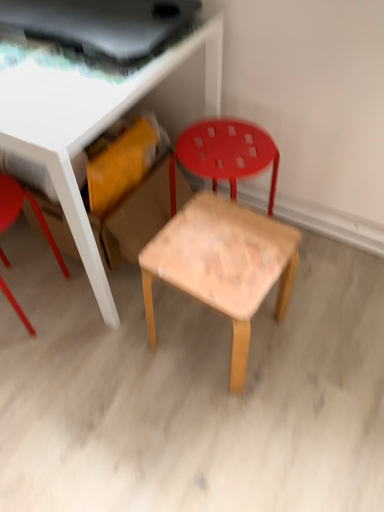
The width and height of the screenshot is (384, 512). What do you see at coordinates (225, 154) in the screenshot?
I see `wooden chair at center, which is the 1th chair in right-to-left order` at bounding box center [225, 154].

This screenshot has height=512, width=384. Find the location of `natural wood stool at center`. natural wood stool at center is located at coordinates [223, 265].

Consider the image. Is wooden table at center in contact with matte red stool at left, which is the 1th chair from left to right?

They are not placed beside each other.

Is wooden table at center looking in the opposite direction of matte red stool at left, which is the 1th chair from left to right?

No, wooden table at center is not facing the opposite direction of matte red stool at left, which is the 1th chair from left to right.

Considering the relative sizes of wooden table at center and matte red stool at left, which is the 2th chair from right to left, in the image provided, is wooden table at center taller than matte red stool at left, which is the 2th chair from right to left,?

Correct, wooden table at center is much taller as matte red stool at left, which is the 2th chair from right to left.

Can you confirm if wooden table at center is positioned to the right of matte red stool at left, which is the 2th chair from right to left?

Indeed, wooden table at center is positioned on the right side of matte red stool at left, which is the 2th chair from right to left.

Who is taller, matte red stool at left, which is the 1th chair from left to right, or wooden table at center?

wooden table at center is taller.

Considering the sizes of objects matte red stool at left, which is the 1th chair from left to right, and wooden table at center in the image provided, who is smaller, matte red stool at left, which is the 1th chair from left to right, or wooden table at center?

With smaller size is matte red stool at left, which is the 1th chair from left to right.

From a real-world perspective, is matte red stool at left, which is the 2th chair from right to left, physically located above or below wooden table at center?

matte red stool at left, which is the 2th chair from right to left, is situated lower than wooden table at center in the real world.

Between matte red stool at left, which is the 2th chair from right to left, and wooden table at center, which one is positioned behind?

matte red stool at left, which is the 2th chair from right to left, is further from the camera.

Is natural wood stool at center oriented towards wooden chair at center, which is the 1th chair in right-to-left order?

No, natural wood stool at center is not facing towards wooden chair at center, which is the 1th chair in right-to-left order.

Identify the location of side table beneath the wooden chair at center, marked as the second chair in a left-to-right arrangement (from a real-world perspective). This screenshot has width=384, height=512. (223, 265).

Is natural wood stool at center to the left of wooden chair at center, which is the 1th chair in right-to-left order, from the viewer's perspective?

Yes.

Which of these two, natural wood stool at center or wooden chair at center, marked as the second chair in a left-to-right arrangement, is smaller?

wooden chair at center, marked as the second chair in a left-to-right arrangement.

What's the angular difference between wooden chair at center, which is the 1th chair in right-to-left order, and wooden table at center's facing directions?

The facing directions of wooden chair at center, which is the 1th chair in right-to-left order, and wooden table at center are 89.8 degrees apart.

Looking at this image, does wooden chair at center, which is the 1th chair in right-to-left order, contain wooden table at center?

No, wooden table at center is not surrounded by wooden chair at center, which is the 1th chair in right-to-left order.

Find the location of a particular element. Image resolution: width=384 pixels, height=512 pixels. table on the left of the wooden chair at center, which is the 1th chair in right-to-left order is located at coordinates (90, 126).

From a real-world perspective, is wooden chair at center, which is the 1th chair in right-to-left order, located higher than wooden table at center?

Actually, wooden chair at center, which is the 1th chair in right-to-left order, is physically below wooden table at center in the real world.

Could you tell me if matte red stool at left, which is the 2th chair from right to left, is facing natural wood stool at center?

No.

From a real-world perspective, is matte red stool at left, which is the 1th chair from left to right, on natural wood stool at center?

Yes.

Can you confirm if matte red stool at left, which is the 2th chair from right to left, is thinner than wooden chair at center, marked as the second chair in a left-to-right arrangement?

No.

Is matte red stool at left, which is the 2th chair from right to left, inside the boundaries of wooden chair at center, which is the 1th chair in right-to-left order, or outside?

matte red stool at left, which is the 2th chair from right to left, cannot be found inside wooden chair at center, which is the 1th chair in right-to-left order.

Is matte red stool at left, which is the 2th chair from right to left, facing towards wooden chair at center, marked as the second chair in a left-to-right arrangement?

No.

Does point (180, 240) appear closer or farther from the camera than point (77, 190)?

Point (180, 240) is farther from the camera than point (77, 190).

Does natural wood stool at center have a smaller size compared to wooden table at center?

Correct, natural wood stool at center occupies less space than wooden table at center.

Does natural wood stool at center come behind wooden table at center?

Yes, the depth of natural wood stool at center is greater than that of wooden table at center.

Could you tell me if natural wood stool at center is turned towards wooden table at center?

Yes, natural wood stool at center is aimed at wooden table at center.

The height and width of the screenshot is (512, 384). Find the location of `the 1st chair behind the wooden table at center, starting your count from the anchor`. the 1st chair behind the wooden table at center, starting your count from the anchor is located at coordinates (20, 211).

Find the location of a particular element. table in front of the matte red stool at left, which is the 2th chair from right to left is located at coordinates (90, 126).

Based on their spatial positions, is natural wood stool at center or wooden table at center further from matte red stool at left, which is the 1th chair from left to right?

natural wood stool at center is further to matte red stool at left, which is the 1th chair from left to right.

Estimate the real-world distances between objects in this image. Which object is closer to wooden chair at center, marked as the second chair in a left-to-right arrangement, wooden table at center or matte red stool at left, which is the 2th chair from right to left?

Based on the image, wooden table at center appears to be nearer to wooden chair at center, marked as the second chair in a left-to-right arrangement.

Which object lies nearer to the anchor point wooden chair at center, marked as the second chair in a left-to-right arrangement, wooden table at center or natural wood stool at center?

natural wood stool at center lies closer to wooden chair at center, marked as the second chair in a left-to-right arrangement, than the other object.

Looking at the image, which one is located further to natural wood stool at center, wooden table at center or matte red stool at left, which is the 1th chair from left to right?

Based on the image, matte red stool at left, which is the 1th chair from left to right, appears to be further to natural wood stool at center.

When comparing their distances from natural wood stool at center, does wooden chair at center, which is the 1th chair in right-to-left order, or wooden table at center seem closer?

Among the two, wooden chair at center, which is the 1th chair in right-to-left order, is located nearer to natural wood stool at center.

Based on their spatial positions, is wooden chair at center, which is the 1th chair in right-to-left order, or matte red stool at left, which is the 2th chair from right to left, further from wooden table at center?

matte red stool at left, which is the 2th chair from right to left, lies further to wooden table at center than the other object.

Estimate the real-world distances between objects in this image. Which object is closer to wooden chair at center, which is the 1th chair in right-to-left order, natural wood stool at center or wooden table at center?

The object closer to wooden chair at center, which is the 1th chair in right-to-left order, is natural wood stool at center.

Based on the photo, estimate the real-world distances between objects in this image. Which object is further from natural wood stool at center, wooden chair at center, which is the 1th chair in right-to-left order, or matte red stool at left, which is the 2th chair from right to left?

Based on the image, matte red stool at left, which is the 2th chair from right to left, appears to be further to natural wood stool at center.

At what (x,y) coordinates should I click in order to perform the action: click on side table located between wooden table at center and wooden chair at center, marked as the second chair in a left-to-right arrangement, in the left-right direction. Please return your answer as a coordinate pair (x, y). The image size is (384, 512). Looking at the image, I should click on point(223,265).

Locate an element on the screen. The image size is (384, 512). side table between matte red stool at left, which is the 2th chair from right to left, and wooden chair at center, marked as the second chair in a left-to-right arrangement, in the horizontal direction is located at coordinates (223, 265).

Locate an element on the screen. This screenshot has width=384, height=512. table between matte red stool at left, which is the 1th chair from left to right, and wooden chair at center, which is the 1th chair in right-to-left order is located at coordinates (90, 126).

Find the location of `table situated between matte red stool at left, which is the 2th chair from right to left, and natural wood stool at center from left to right`. table situated between matte red stool at left, which is the 2th chair from right to left, and natural wood stool at center from left to right is located at coordinates (90, 126).